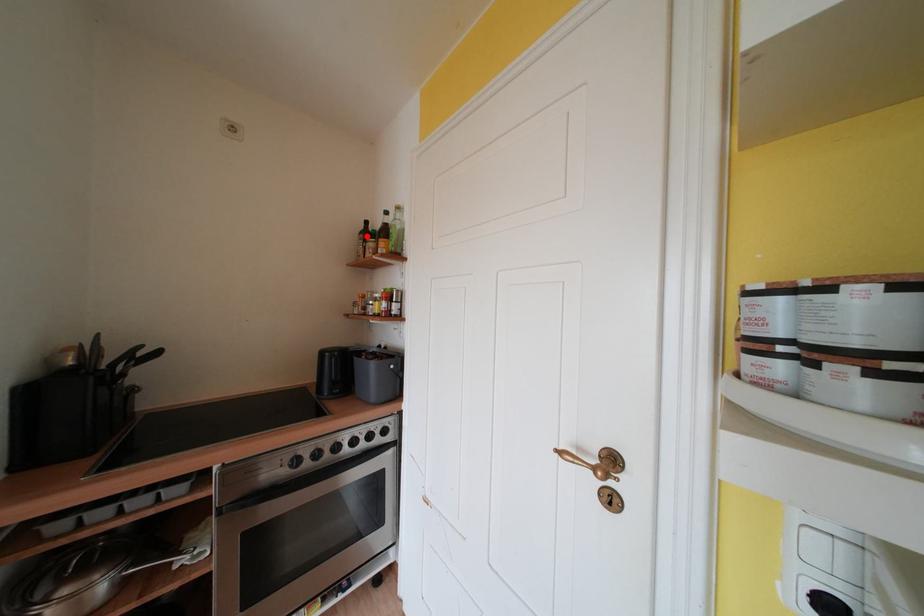
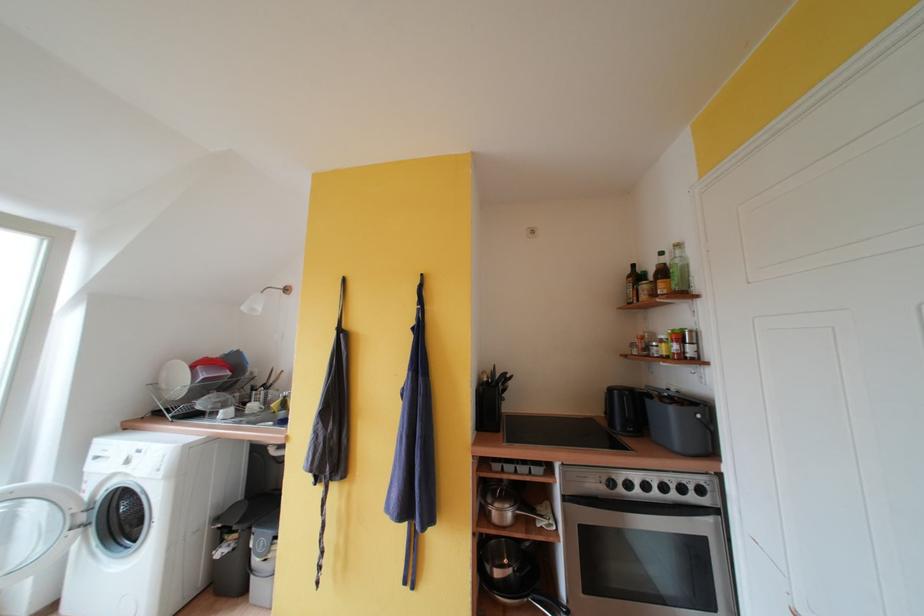
Locate, in the second image, the point that corresponds to the highlighted location in the first image.

(634, 281)